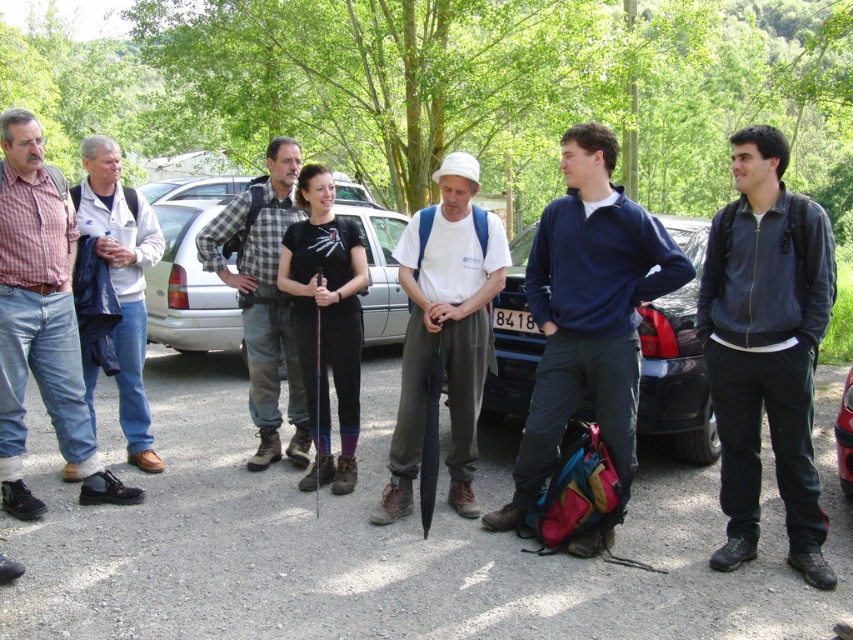
You are planning to borrow a jacket from either the dark blue jacket at right or the white cotton jacket at left. Which jacket would you choose if you want a larger one?

The dark blue jacket at right has a larger size compared to the white cotton jacket at left, so you should choose the dark blue jacket at right.